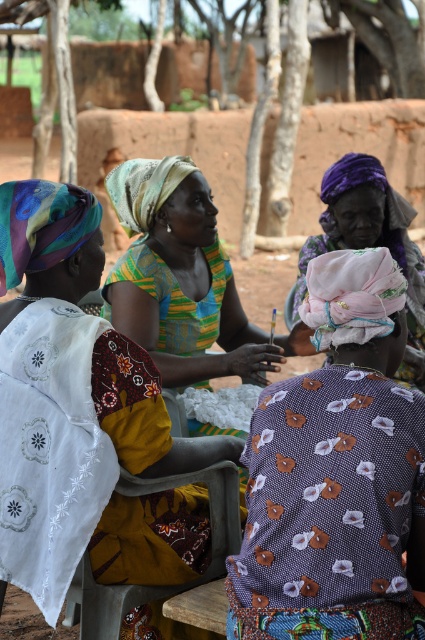
You are a photographer standing at the center of the scene. You want to capture a closeup shot of the purple printed fabric at center. Which direction should you move to get closer to it?

The purple printed fabric at center is located at point (337, 474), so you should move towards the direction of that coordinate to get closer.

Looking at the scene, which object is positioned to the right of the other between the embroidered cotton dress at left and the purple fabric headscarf at center?

The purple fabric headscarf at center is to the right of the embroidered cotton dress at left.

You are standing in the rural setting where the women are seated. There are two points marked in the image. The first point is at coordinates point (387,332) and the second is at point (328,248). Which point is closer to you?

Point (387,332) is in front of point (328,248), so it is closer to you.